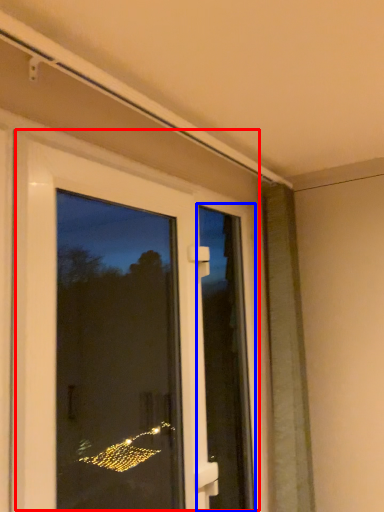
Question: Among these objects, which one is nearest to the camera, door (highlighted by a red box) or screen door (highlighted by a blue box)?

Choices:
 (A) door
 (B) screen door

Answer: (A)